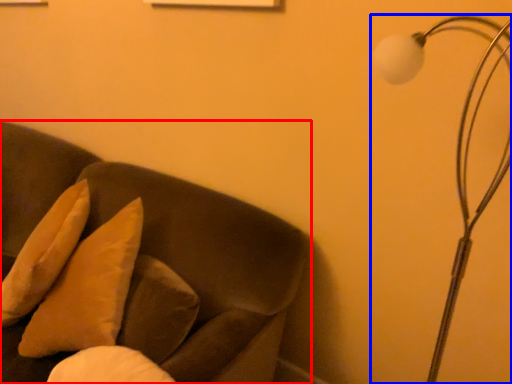
Question: Which object appears closest to the camera in this image, furniture (highlighted by a red box) or lamp (highlighted by a blue box)?

Choices:
 (A) furniture
 (B) lamp

Answer: (B)